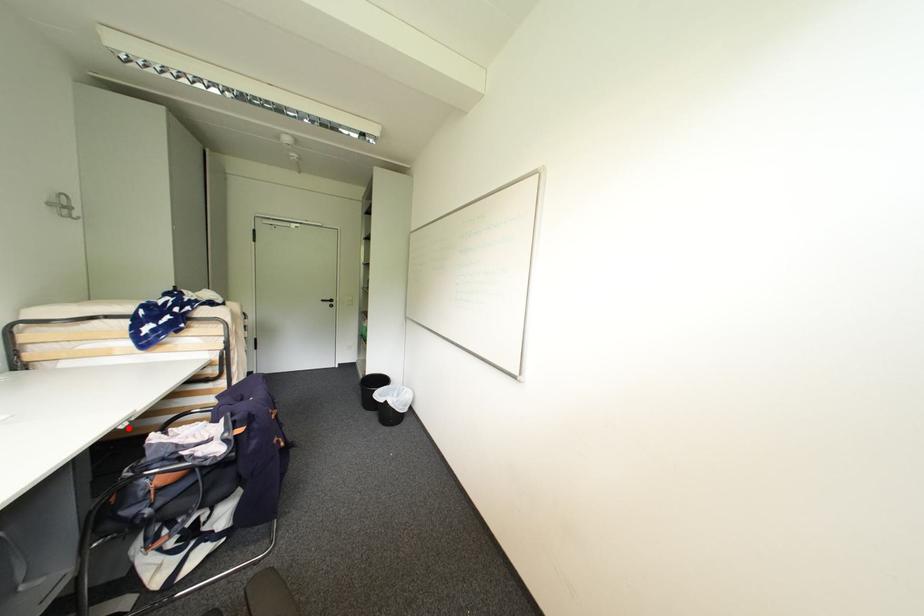
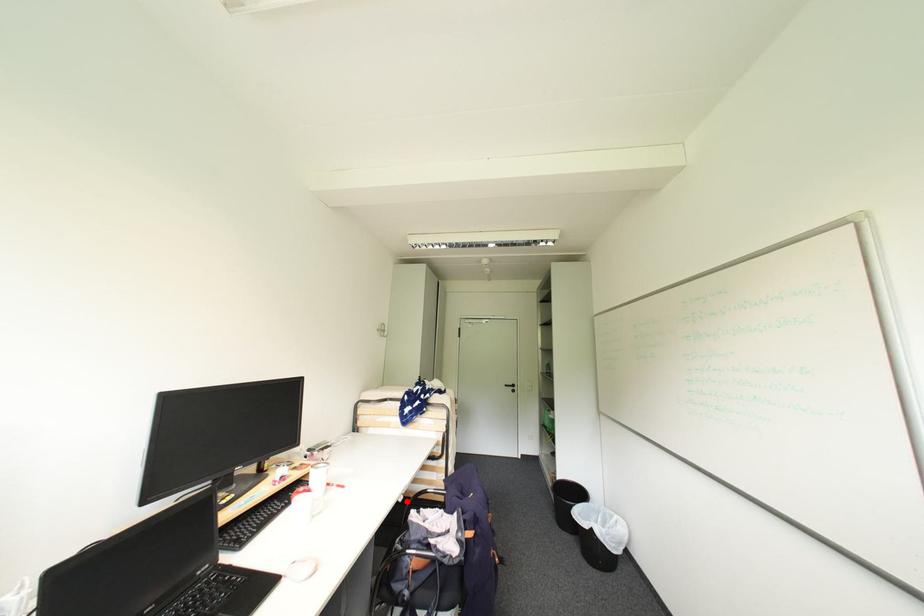
Consider the image. I am providing you with two images of the same scene from different viewpoints. A red point is marked on the first image and another point is marked on the second image. Is the marked point in image1 the same physical position as the marked point in image2?

Yes